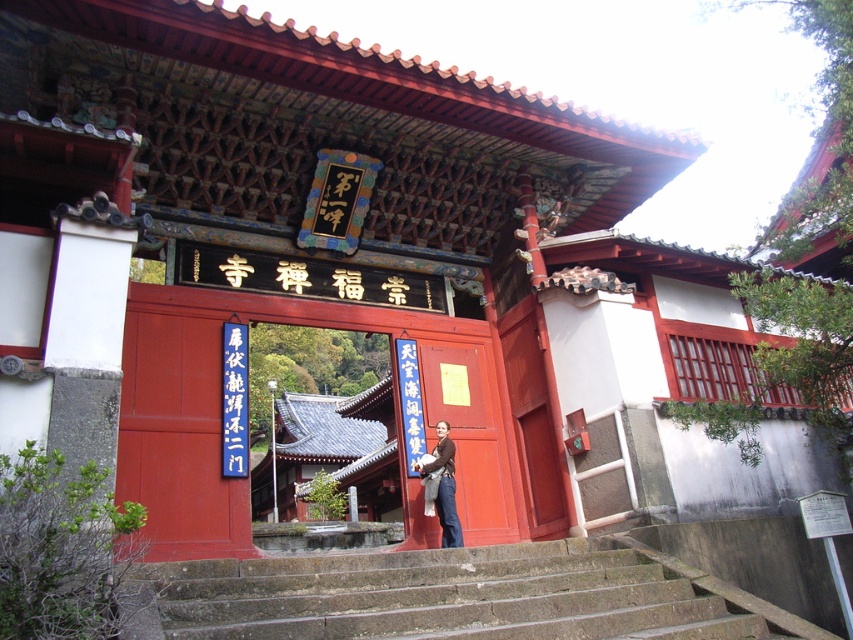
You are a visitor at the temple gate. You notice a matte wood door at center and a brown leather jacket at center. Which object is taller?

The brown leather jacket at center is taller than the matte wood door at center.

You are standing in front of the temple gate and notice two points marked on the structure. One is at coordinate point [538,620] and the other at point [416,465]. Which of these points is nearer to your current position?

Point [538,620] is closer to the camera than point [416,465], so the point at coordinate [538,620] is nearer to your current position.